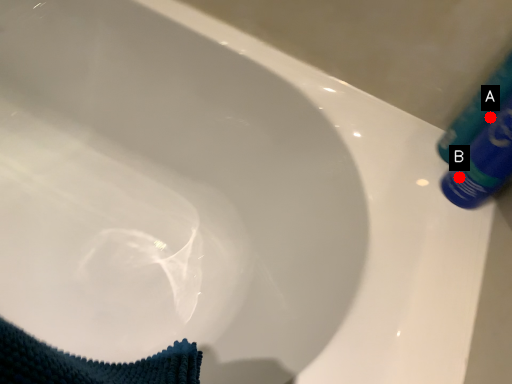
Question: Two points are circled on the image, labeled by A and B beside each circle. Which point is farther from the camera taking this photo?

Choices:
 (A) A is further
 (B) B is further

Answer: (B)